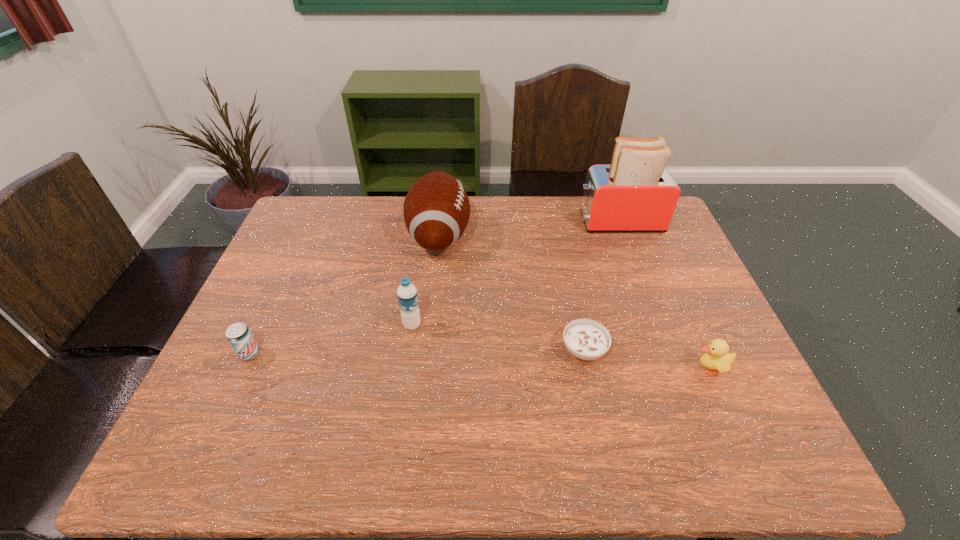
Where is `vacant position located on the laces of the second tallest object`? vacant position located on the laces of the second tallest object is located at coordinates (573, 236).

This screenshot has width=960, height=540. What are the coordinates of `vacant space located 0.120m on the label of the third tallest object` in the screenshot? It's located at (466, 325).

The width and height of the screenshot is (960, 540). What are the coordinates of `free space located on the front-facing side of the duckling` in the screenshot? It's located at (598, 368).

The image size is (960, 540). I want to click on vacant space situated 0.100m on the front-facing side of the duckling, so click(x=651, y=368).

Find the location of a particular element. This screenshot has height=540, width=960. free spot located on the front-facing side of the duckling is located at coordinates (541, 368).

Locate an element on the screen. vacant point located on the back of the beer can is located at coordinates (275, 298).

Locate an element on the screen. blank area located 0.150m on the front of the soup bowl is located at coordinates (600, 426).

You are a GUI agent. You are given a task and a screenshot of the screen. Output one action in this format:
    pyautogui.click(x=<x>, y=<y>)
    Task: Click on the toaster present at the far edge
    
    Given the screenshot: What is the action you would take?
    pyautogui.click(x=635, y=193)

Locate an element on the screen. football that is at the far edge is located at coordinates (436, 209).

Locate an element on the screen. object at the left edge is located at coordinates (238, 334).